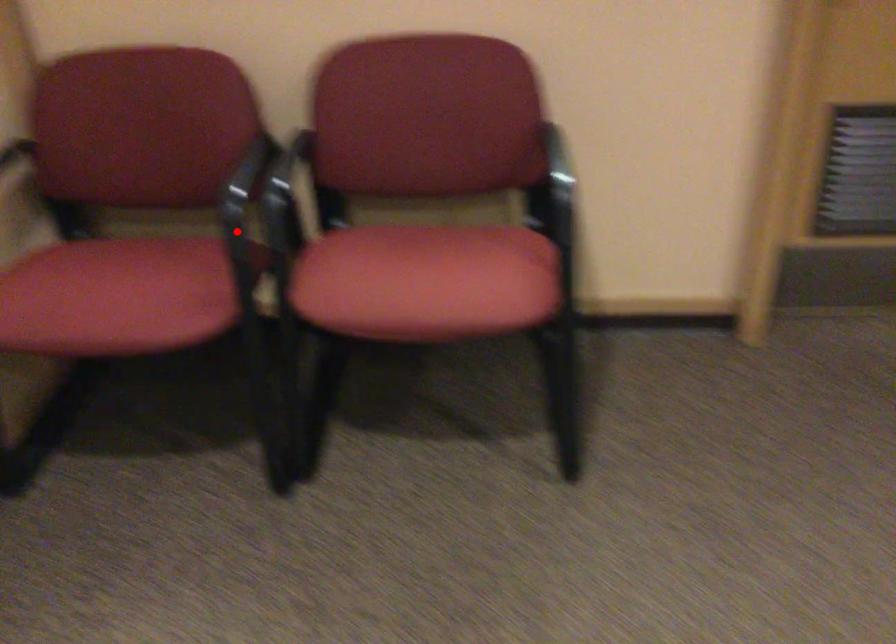
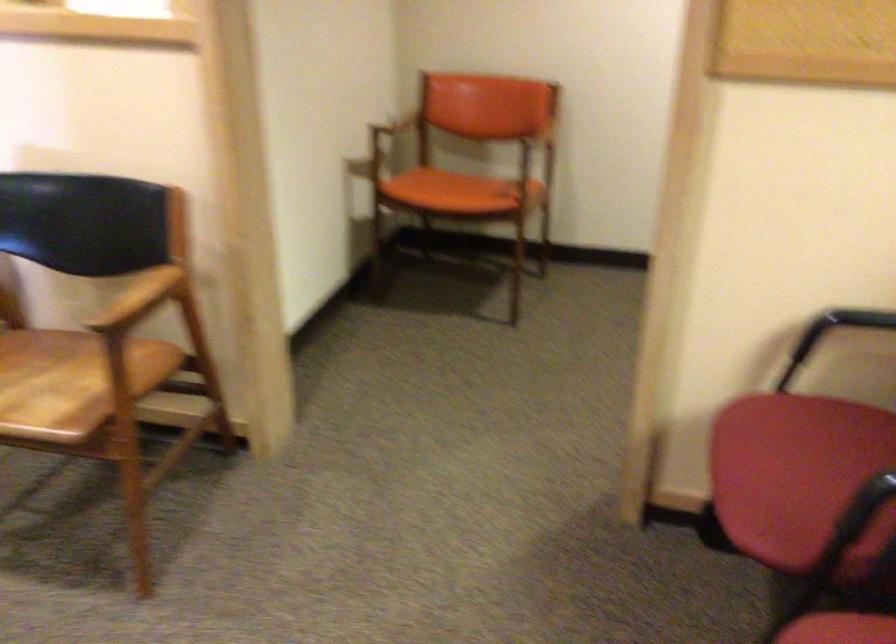
Question: I am providing you with two images of the same scene from different viewpoints. Image1 has a red point marked. In image2, the corresponding 3D location appears at what relative position? Reply with the corresponding letter.

Choices:
 (A) Closer
 (B) Farther

Answer: (A)